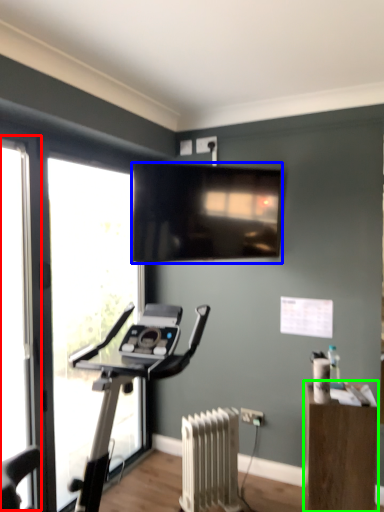
Question: Which object is the closest to the screen door (highlighted by a red box)? Choose among these: television (highlighted by a blue box) or furniture (highlighted by a green box).

Choices:
 (A) television
 (B) furniture

Answer: (A)